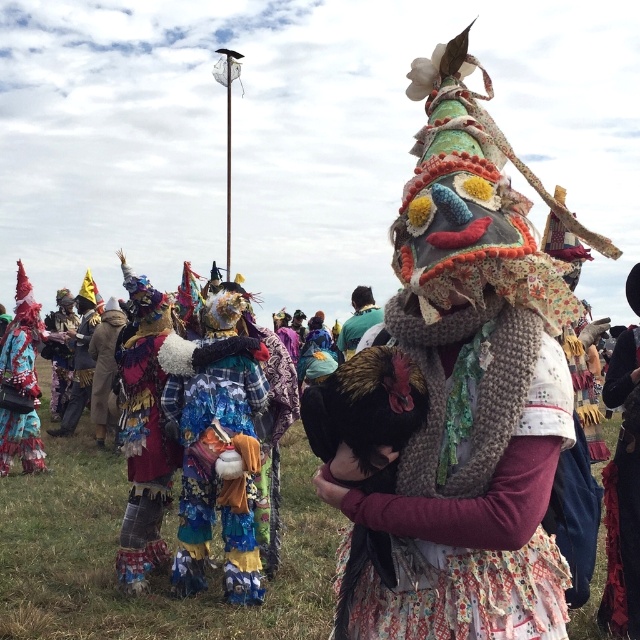
From the picture: You are a photographer at the event and want to capture both the multicolored fabric at center and the shiny red fabric at left in the same frame. Which fabric should you focus on to ensure both are visible without one blocking the other?

The multicolored fabric at center is in front of the shiny red fabric at left, so focusing on the multicolored fabric at center will allow both to be visible while minimizing overlap.

In the scene shown: You are an event planner trying to arrange decorations for a festival. You have two fabrics available for display, the multicolored fabric at center and the shiny red fabric at left. Given their sizes, which fabric would you choose to cover a large table if you want to ensure full coverage without any gaps?

The multicolored fabric at center has a greater width than the shiny red fabric at left, so it would be the better choice to cover a large table without gaps.

What is located at the coordinates point (218, 472) in the image?

The point (218, 472) corresponds to the multicolored fabric at center.